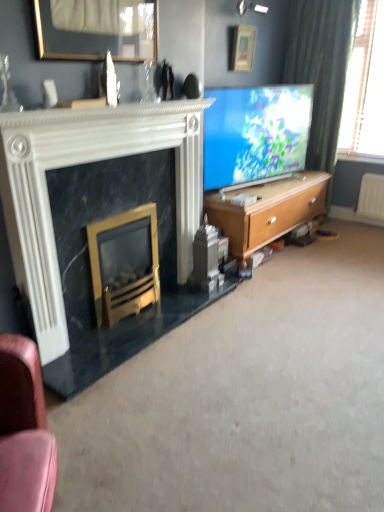
This screenshot has height=512, width=384. What do you see at coordinates (255, 133) in the screenshot?
I see `matte blue screen at center` at bounding box center [255, 133].

What is the approximate width of wooden cabinet at right?

The width of wooden cabinet at right is 22.08 inches.

Locate an element on the screen. wooden cabinet at right is located at coordinates (267, 211).

The width and height of the screenshot is (384, 512). Identify the location of matte blue screen at center. 255,133.

Between gold metallic fireplace at lower left, the first fireplace when ordered from bottom to top, and matte white picture frame at upper center, placed as the second picture frame when sorted from front to back, which one has less height?

matte white picture frame at upper center, placed as the second picture frame when sorted from front to back, is shorter.

Does point (111, 298) appear closer or farther from the camera than point (250, 63)?

Clearly, point (111, 298) is closer to the camera than point (250, 63).

Considering the relative sizes of gold metallic fireplace at lower left, which is the second fireplace from top to bottom, and matte white picture frame at upper center, arranged as the 1th picture frame when viewed from the back, in the image provided, is gold metallic fireplace at lower left, which is the second fireplace from top to bottom, thinner than matte white picture frame at upper center, arranged as the 1th picture frame when viewed from the back,?

Incorrect, the width of gold metallic fireplace at lower left, which is the second fireplace from top to bottom, is not less than that of matte white picture frame at upper center, arranged as the 1th picture frame when viewed from the back.

Identify the location of the 2nd fireplace directly beneath the matte white picture frame at upper center, the 1th picture frame when ordered from right to left (from a real-world perspective). This screenshot has height=512, width=384. point(124,263).

Is wooden cabinet at right at the left side of wooden picture frame at upper center, the second picture frame when ordered from top to bottom?

No, wooden cabinet at right is not to the left of wooden picture frame at upper center, the second picture frame when ordered from top to bottom.

Which of these two, wooden cabinet at right or wooden picture frame at upper center, marked as the 1th picture frame in a bottom-to-top arrangement, is wider?

wooden cabinet at right.

Find the location of a particular element. cabinetry behind the wooden picture frame at upper center, the second picture frame when ordered from top to bottom is located at coordinates (267, 211).

Locate an element on the screen. Image resolution: width=384 pixels, height=512 pixels. cabinetry on the right of matte white picture frame at upper center, the 1th picture frame when ordered from right to left is located at coordinates tap(267, 211).

Is wooden cabinet at right bigger or smaller than matte white picture frame at upper center, which is the 2th picture frame in left-to-right order?

Clearly, wooden cabinet at right is larger in size than matte white picture frame at upper center, which is the 2th picture frame in left-to-right order.

Is the depth of wooden cabinet at right greater than that of matte white picture frame at upper center, arranged as the 1th picture frame when viewed from the back?

No, it is not.

Which is behind, point (136, 29) or point (253, 111)?

The point (253, 111) is farther.

Can you confirm if wooden picture frame at upper center, marked as the 1th picture frame in a bottom-to-top arrangement, is taller than matte blue screen at center?

In fact, wooden picture frame at upper center, marked as the 1th picture frame in a bottom-to-top arrangement, may be shorter than matte blue screen at center.

Locate an element on the screen. This screenshot has height=512, width=384. television that is on the right side of wooden picture frame at upper center, the second picture frame when ordered from top to bottom is located at coordinates (255, 133).

Is wooden picture frame at upper center, placed as the second picture frame when sorted from right to left, to the left or to the right of matte blue screen at center in the image?

wooden picture frame at upper center, placed as the second picture frame when sorted from right to left, is positioned on matte blue screen at center's left side.

Who is bigger, wooden picture frame at upper center, which is the second picture frame in back-to-front order, or wooden cabinet at right?

wooden cabinet at right.

Is wooden picture frame at upper center, which is the second picture frame in back-to-front order, shorter than wooden cabinet at right?

Yes, wooden picture frame at upper center, which is the second picture frame in back-to-front order, is shorter than wooden cabinet at right.

From a real-world perspective, which object stands above the other?

From a 3D spatial view, wooden picture frame at upper center, marked as the 1th picture frame in a bottom-to-top arrangement, is above.

From the image's perspective, is wooden picture frame at upper center, placed as the second picture frame when sorted from right to left, on wooden cabinet at right?

Yes.

Considering the sizes of objects matte blue screen at center and wooden picture frame at upper center, the second picture frame when ordered from top to bottom, in the image provided, who is bigger, matte blue screen at center or wooden picture frame at upper center, the second picture frame when ordered from top to bottom,?

matte blue screen at center.

Which object is positioned more to the left, matte blue screen at center or wooden picture frame at upper center, marked as the 1th picture frame in a bottom-to-top arrangement?

Positioned to the left is wooden picture frame at upper center, marked as the 1th picture frame in a bottom-to-top arrangement.

Is matte blue screen at center further to the viewer compared to wooden picture frame at upper center, placed as the first picture frame when sorted from front to back?

Yes, matte blue screen at center is behind wooden picture frame at upper center, placed as the first picture frame when sorted from front to back.

Which object is wider, matte blue screen at center or wooden cabinet at right?

wooden cabinet at right is wider.

Are matte blue screen at center and wooden cabinet at right making contact?

matte blue screen at center and wooden cabinet at right are not in contact.

Does matte blue screen at center have a greater height compared to wooden cabinet at right?

Yes, matte blue screen at center is taller than wooden cabinet at right.

From a real-world perspective, starting from the matte white picture frame at upper center, the 1th picture frame when ordered from right to left, which fireplace is the 2nd one below it? Please provide its 2D coordinates.

[(124, 263)]

Identify the location of cabinetry behind the wooden picture frame at upper center, marked as the 1th picture frame in a bottom-to-top arrangement. The image size is (384, 512). (267, 211).

Based on their spatial positions, is wooden picture frame at upper center, arranged as the 1th picture frame when viewed from the left, or gold metallic fireplace at lower left, which is the second fireplace from top to bottom, closer to white marble fireplace at left, which is the 2th fireplace in bottom-to-top order?

gold metallic fireplace at lower left, which is the second fireplace from top to bottom, is positioned closer to the anchor white marble fireplace at left, which is the 2th fireplace in bottom-to-top order.

Estimate the real-world distances between objects in this image. Which object is closer to wooden cabinet at right, white marble fireplace at left, acting as the 1th fireplace starting from the top, or wooden picture frame at upper center, placed as the second picture frame when sorted from right to left?

white marble fireplace at left, acting as the 1th fireplace starting from the top.

Estimate the real-world distances between objects in this image. Which object is closer to gold metallic fireplace at lower left, the first fireplace when ordered from bottom to top, matte blue screen at center or white marble fireplace at left, acting as the 1th fireplace starting from the top?

white marble fireplace at left, acting as the 1th fireplace starting from the top, is closer to gold metallic fireplace at lower left, the first fireplace when ordered from bottom to top.

Looking at the image, which one is located further to wooden cabinet at right, gold metallic fireplace at lower left, the first fireplace when ordered from bottom to top, or matte blue screen at center?

gold metallic fireplace at lower left, the first fireplace when ordered from bottom to top.

When comparing their distances from matte blue screen at center, does matte white picture frame at upper center, the second picture frame when ordered from bottom to top, or gold metallic fireplace at lower left, the first fireplace when ordered from bottom to top, seem closer?

matte white picture frame at upper center, the second picture frame when ordered from bottom to top, lies closer to matte blue screen at center than the other object.

Looking at the image, which one is located closer to wooden cabinet at right, wooden picture frame at upper center, which is the second picture frame in back-to-front order, or gold metallic fireplace at lower left, the first fireplace when ordered from bottom to top?

gold metallic fireplace at lower left, the first fireplace when ordered from bottom to top, lies closer to wooden cabinet at right than the other object.

Considering their positions, is wooden cabinet at right positioned further to gold metallic fireplace at lower left, which is the second fireplace from top to bottom, than matte white picture frame at upper center, arranged as the 1th picture frame when viewed from the back?

Among the two, matte white picture frame at upper center, arranged as the 1th picture frame when viewed from the back, is located further to gold metallic fireplace at lower left, which is the second fireplace from top to bottom.

Considering their positions, is white marble fireplace at left, acting as the 1th fireplace starting from the top, positioned closer to matte white picture frame at upper center, the first picture frame when ordered from top to bottom, than matte blue screen at center?

The object closer to matte white picture frame at upper center, the first picture frame when ordered from top to bottom, is matte blue screen at center.

You are a GUI agent. You are given a task and a screenshot of the screen. Output one action in this format:
    pyautogui.click(x=<x>, y=<y>)
    Task: Click on the television between wooden picture frame at upper center, marked as the 1th picture frame in a bottom-to-top arrangement, and wooden cabinet at right, along the z-axis
    The height and width of the screenshot is (512, 384).
    Given the screenshot: What is the action you would take?
    pyautogui.click(x=255, y=133)

Where is `fireplace between white marble fireplace at left, which is the 2th fireplace in bottom-to-top order, and matte blue screen at center from front to back`? fireplace between white marble fireplace at left, which is the 2th fireplace in bottom-to-top order, and matte blue screen at center from front to back is located at coordinates (124, 263).

Locate an element on the screen. fireplace between matte white picture frame at upper center, arranged as the 1th picture frame when viewed from the back, and gold metallic fireplace at lower left, which is the second fireplace from top to bottom, from top to bottom is located at coordinates (81, 163).

Where is `television between white marble fireplace at left, acting as the 1th fireplace starting from the top, and matte white picture frame at upper center, the first picture frame when ordered from top to bottom, in the front-back direction`? The image size is (384, 512). television between white marble fireplace at left, acting as the 1th fireplace starting from the top, and matte white picture frame at upper center, the first picture frame when ordered from top to bottom, in the front-back direction is located at coordinates (255, 133).